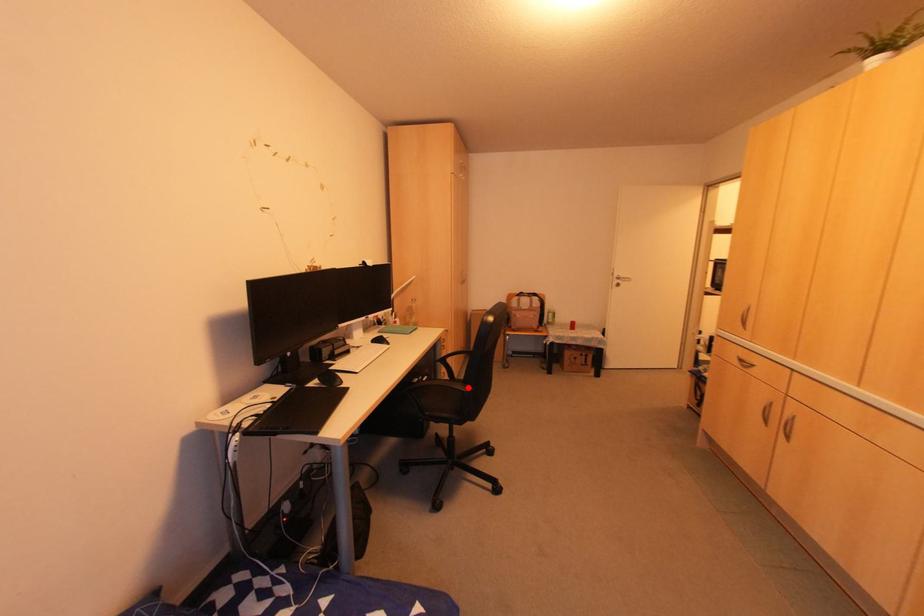
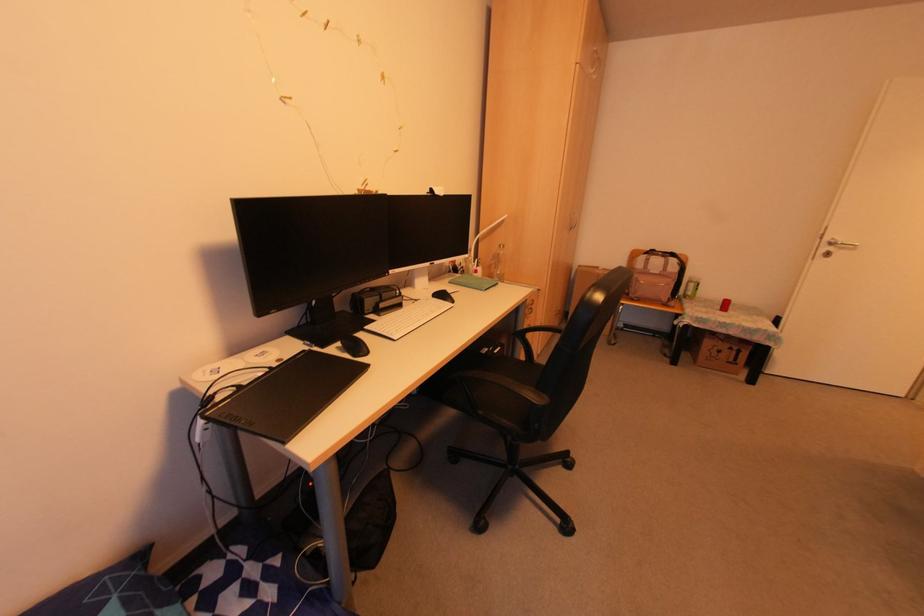
Question: I am providing you with two images of the same scene from different viewpoints. A red point is shown in image1. For the corresponding object point in image2, is it positioned nearer or farther from the camera?

Choices:
 (A) Nearer
 (B) Farther

Answer: (B)